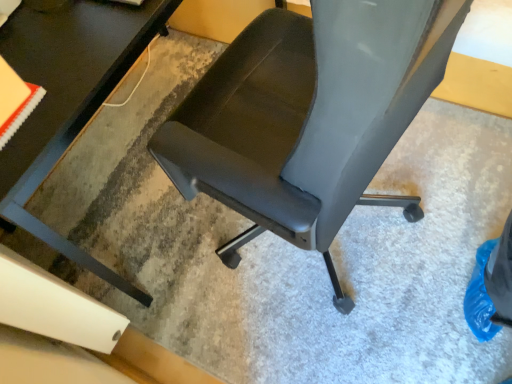
Question: Considering the relative sizes of black glossy table at center and matte black chair at center in the image provided, is black glossy table at center thinner than matte black chair at center?

Choices:
 (A) no
 (B) yes

Answer: (A)

Question: Is black glossy table at center at the left side of matte black chair at center?

Choices:
 (A) yes
 (B) no

Answer: (A)

Question: Considering the relative sizes of black glossy table at center and matte black chair at center in the image provided, is black glossy table at center wider than matte black chair at center?

Choices:
 (A) no
 (B) yes

Answer: (B)

Question: Is black glossy table at center surrounding matte black chair at center?

Choices:
 (A) no
 (B) yes

Answer: (A)

Question: Is black glossy table at center facing towards matte black chair at center?

Choices:
 (A) no
 (B) yes

Answer: (B)

Question: Would you consider black glossy table at center to be distant from matte black chair at center?

Choices:
 (A) yes
 (B) no

Answer: (B)

Question: Does matte black chair at center come behind black glossy table at center?

Choices:
 (A) yes
 (B) no

Answer: (B)

Question: Does matte black chair at center appear on the right side of black glossy table at center?

Choices:
 (A) no
 (B) yes

Answer: (B)

Question: From the image's perspective, is matte black chair at center below black glossy table at center?

Choices:
 (A) no
 (B) yes

Answer: (B)

Question: Can we say matte black chair at center lies outside black glossy table at center?

Choices:
 (A) no
 (B) yes

Answer: (B)

Question: Is matte black chair at center turned away from black glossy table at center?

Choices:
 (A) yes
 (B) no

Answer: (B)

Question: Does matte black chair at center have a greater height compared to black glossy table at center?

Choices:
 (A) yes
 (B) no

Answer: (A)

Question: Is matte black chair at center situated inside black glossy table at center or outside?

Choices:
 (A) inside
 (B) outside

Answer: (B)